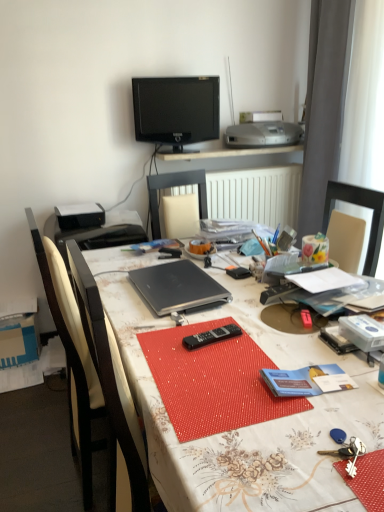
Identify the location of free point in front of black plastic remote control at center, which is the second stationery from right to left. (249, 290).